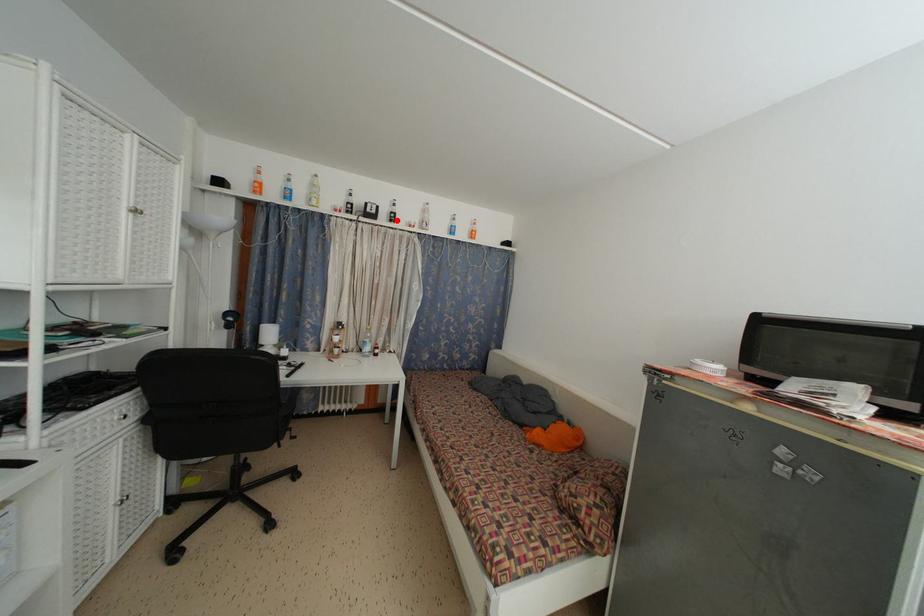
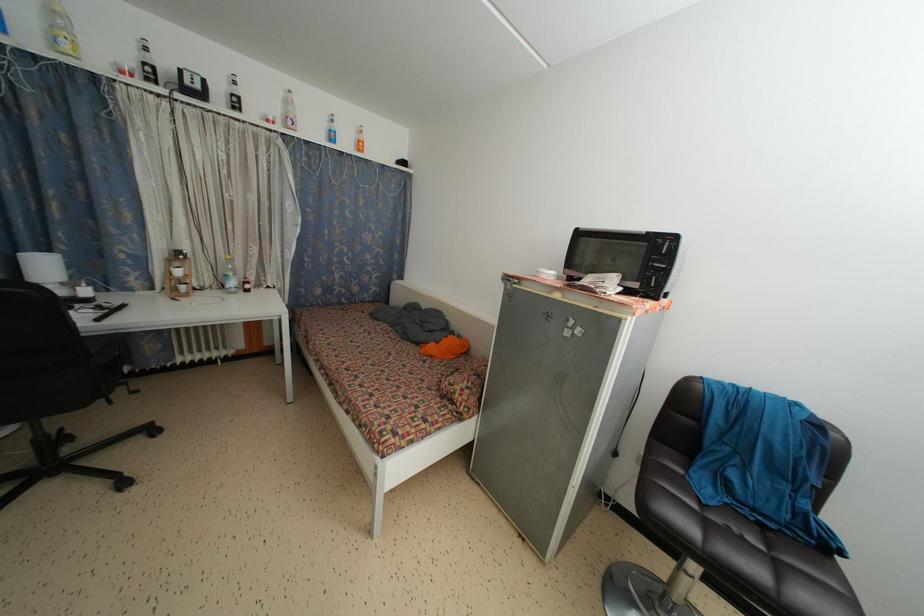
The point at the highlighted location is marked in the first image. Where is the corresponding point in the second image?

(238, 105)